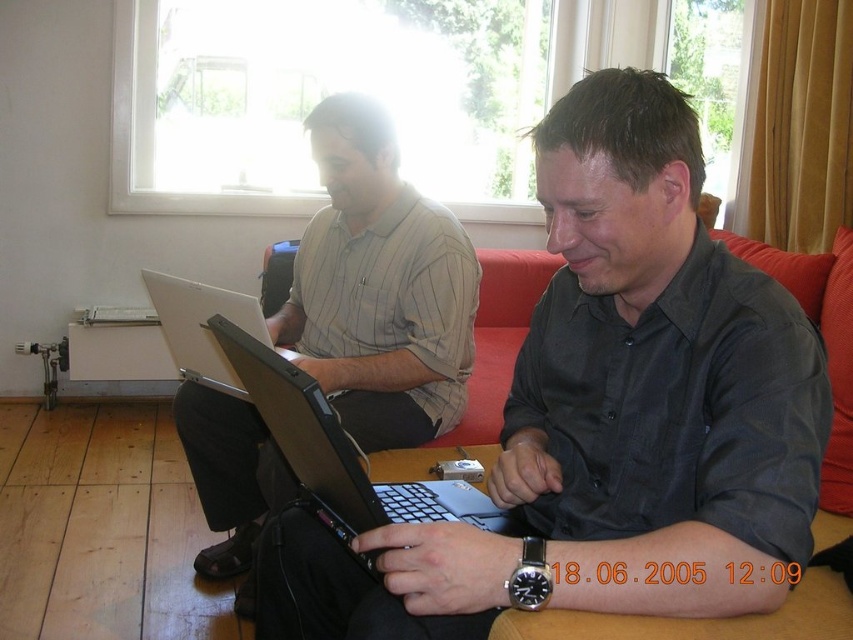
You are a photographer in the living room and want to take a photo of both the matte black laptop at center and the silver metallic laptop at center. Which laptop should you focus on first if you want to capture both in the same frame without moving the camera?

The matte black laptop at center is located below the silver metallic laptop at center, so you should focus on the silver metallic laptop at center first as it is higher up in the frame to ensure both are in the same shot.

You are a photographer setting up a shoot in this living room. You need to position a light source to the left of the matte gray shirt at center to highlight it. Will the light source also illuminate the matte black laptop at center?

The matte black laptop at center is positioned on the right side of the matte gray shirt at center. Since the light source is placed to the left of the matte gray shirt at center, it will also illuminate the matte black laptop at center because it is to the right of the shirt.

You are a delivery person who needs to place a small package between the black matte laptop at center and the silver metallic laptop at center. Can you fit it there?

The black matte laptop at center is positioned on the right side of silver metallic laptop at center, so there is space between them to place the small package.